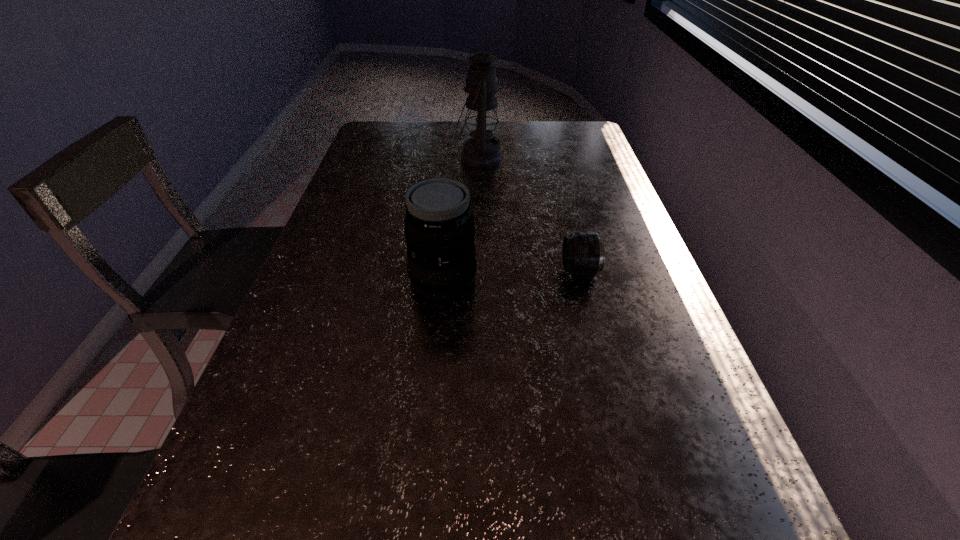
At what (x,y) coordinates should I click in order to perform the action: click on the farthest object. Please return your answer as a coordinate pair (x, y). The height and width of the screenshot is (540, 960). Looking at the image, I should click on (482, 150).

Find the location of a particular element. The width and height of the screenshot is (960, 540). the tallest object is located at coordinates (482, 150).

Where is `the left telephoto lens`? Image resolution: width=960 pixels, height=540 pixels. the left telephoto lens is located at coordinates (439, 229).

Where is `the second tallest object`? The image size is (960, 540). the second tallest object is located at coordinates [439, 229].

This screenshot has height=540, width=960. What are the coordinates of `the shorter telephoto lens` in the screenshot? It's located at tap(583, 254).

What are the coordinates of `the shortest object` in the screenshot? It's located at (583, 254).

You are a GUI agent. You are given a task and a screenshot of the screen. Output one action in this format:
    pyautogui.click(x=<x>, y=<y>)
    Task: Click on the free space located 0.200m on the front of the farthest object
    The width and height of the screenshot is (960, 540).
    Given the screenshot: What is the action you would take?
    point(479,207)

At what (x,y) coordinates should I click in order to perform the action: click on vacant space located on the front of the second shortest object. Please return your answer as a coordinate pair (x, y). This screenshot has width=960, height=540. Looking at the image, I should click on (436, 362).

Identify the location of free space located at the front element of the shortest object. (492, 271).

Where is `vacant area situated at the front element of the shortest object`? The image size is (960, 540). vacant area situated at the front element of the shortest object is located at coordinates (510, 271).